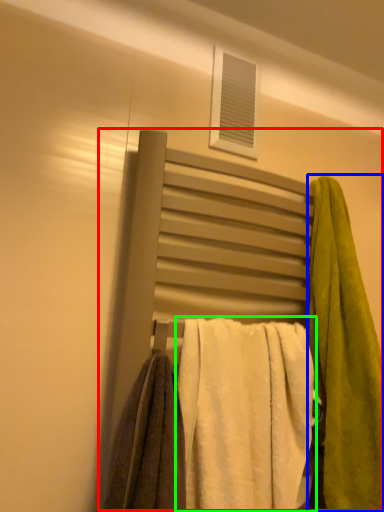
Question: Based on their relative distances, which object is farther from bed (highlighted by a red box)? Choose from towel (highlighted by a blue box) and towel (highlighted by a green box).

Choices:
 (A) towel
 (B) towel

Answer: (B)